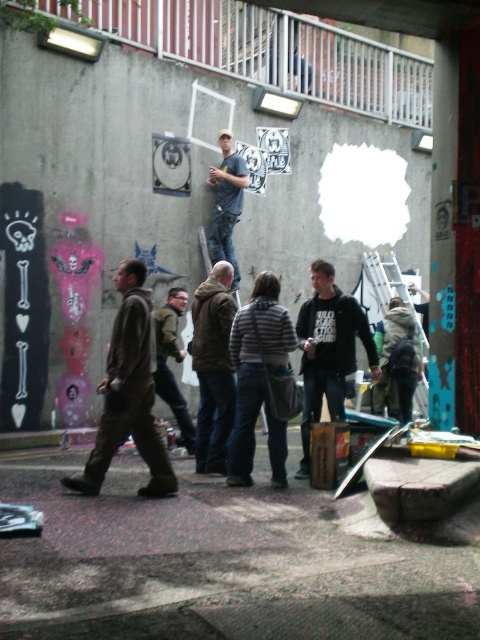
You are a photographer trying to capture a candid shot of the street art scene. You notice the dark brown leather jacket at center and the blue denim jeans at center. Which clothing item appears narrower in the photo?

The dark brown leather jacket at center appears narrower than the blue denim jeans at center because its width is less than the jeans.

You are a pedestrian walking down the street and see the black matte hoodie at center and the metallic silver ladder at center. Which object is wider from your perspective?

The black matte hoodie at center might be wider than metallic silver ladder at center according to the description.